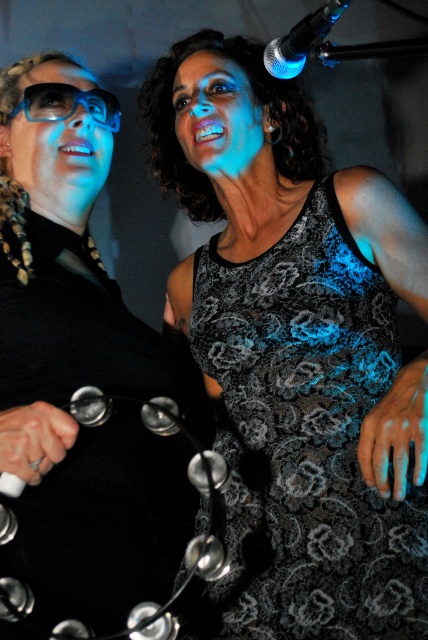
You are standing at the center of the room and see the black lace dress at upper right. Can you tell me what is located at the coordinates point (x=80, y=368)?

The point (x=80, y=368) is where the black lace dress at upper right is located.

You are organizing a charity event and need to place the matte black glasses at left and the black lace dress at upper right on a display table. The table has limited space. Which item should you place first to ensure both fit properly?

The black lace dress at upper right is bigger than the matte black glasses at left, so you should place the black lace dress at upper right first to accommodate its larger size before arranging the smaller matte black glasses at left.

You are a photographer at a fashion show. You need to capture a closeup shot of the black lace dress at center without the matte black glasses at left appearing in the frame. Can you do it with a standard camera lens that has a 50mm focal length?

The black lace dress at center is 23.02 inches away from the matte black glasses at left. With a standard 50mm lens, the photographer can likely frame the shot to focus solely on the black lace dress at center while excluding the matte black glasses at left, as the distance between them allows for selective composition.